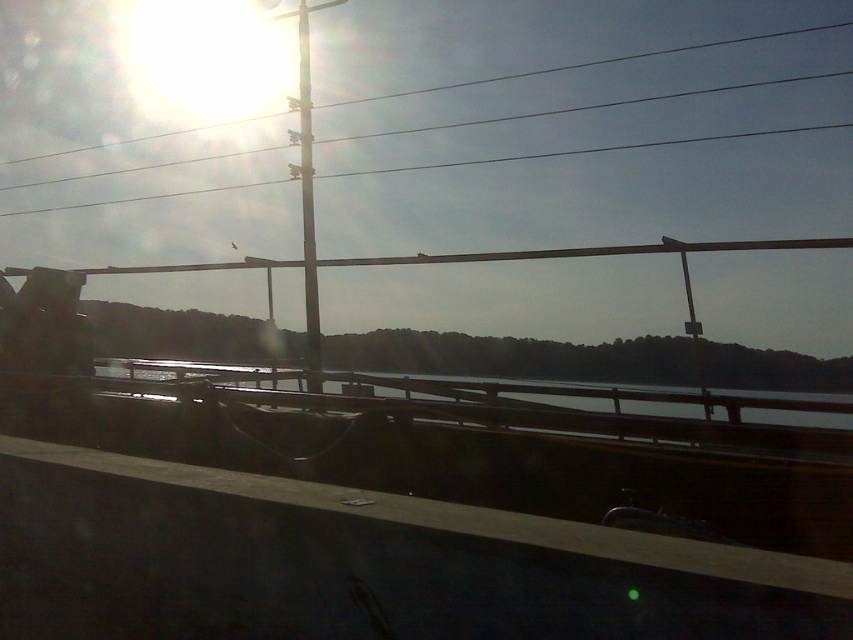
Does clear water at center have a greater height compared to metallic wire at upper center?

No, clear water at center is not taller than metallic wire at upper center.

Can you confirm if clear water at center is positioned below metallic wire at upper center?

Yes, clear water at center is below metallic wire at upper center.

Who is more distant from viewer, (x=303, y=400) or (x=453, y=86)?

Positioned behind is point (x=453, y=86).

At what (x,y) coordinates should I click in order to perform the action: click on clear water at center. Please return your answer as a coordinate pair (x, y). The image size is (853, 640). Looking at the image, I should click on (577, 396).

Is metallic wire at upper center above metallic pole at center?

Indeed, metallic wire at upper center is positioned over metallic pole at center.

Is point (722, 86) farther from viewer compared to point (308, 81)?

Yes.

Where is `metallic wire at upper center`? metallic wire at upper center is located at coordinates (589, 106).

Is clear water at center taller than metallic pole at center?

In fact, clear water at center may be shorter than metallic pole at center.

Does clear water at center have a greater width compared to metallic pole at center?

Indeed, clear water at center has a greater width compared to metallic pole at center.

Is point (477, 387) behind point (306, 84)?

No, (477, 387) is closer to viewer.

Locate an element on the screen. The height and width of the screenshot is (640, 853). clear water at center is located at coordinates (577, 396).